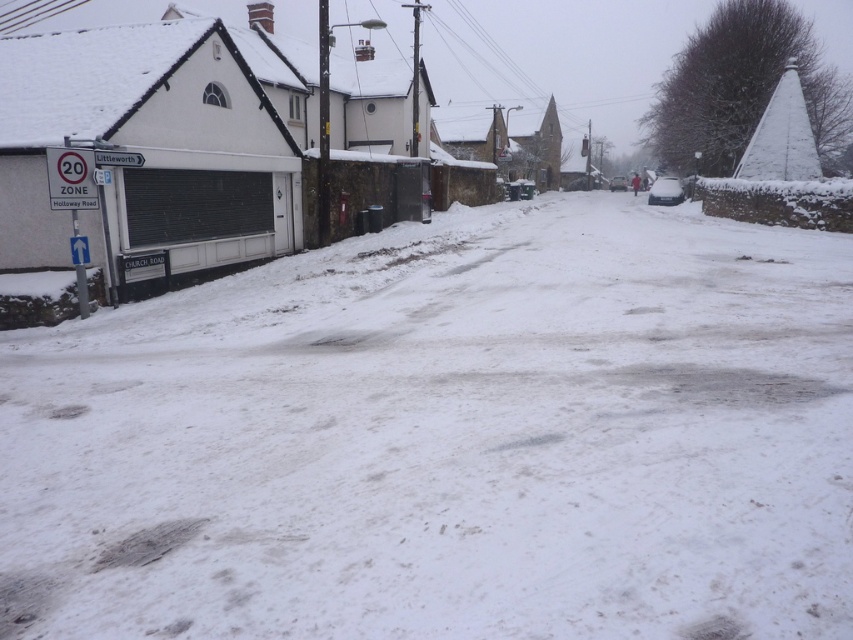
Does point (190, 522) come in front of point (653, 189)?

Yes, point (190, 522) is in front of point (653, 189).

Which is more to the left, gray snow at lower center or snow-covered car at center?

gray snow at lower center is more to the left.

At what (x,y) coordinates should I click in order to perform the action: click on gray snow at lower center. Please return your answer as a coordinate pair (x, y). Looking at the image, I should click on (149, 544).

Which is below, white powdery snow at lower left or gray snow at lower center?

gray snow at lower center is below.

Which is in front, point (788, 291) or point (142, 560)?

Positioned in front is point (142, 560).

This screenshot has width=853, height=640. Identify the location of white powdery snow at lower left. (450, 436).

Is point (697, 548) in front of point (654, 186)?

That is True.

Consider the image. Who is lower down, white powdery snow at lower left or snow-covered car at center?

Positioned lower is white powdery snow at lower left.

Does point (50, 563) come closer to viewer compared to point (682, 193)?

Yes, point (50, 563) is in front of point (682, 193).

Find the location of `white powdery snow at lower left`. white powdery snow at lower left is located at coordinates (450, 436).